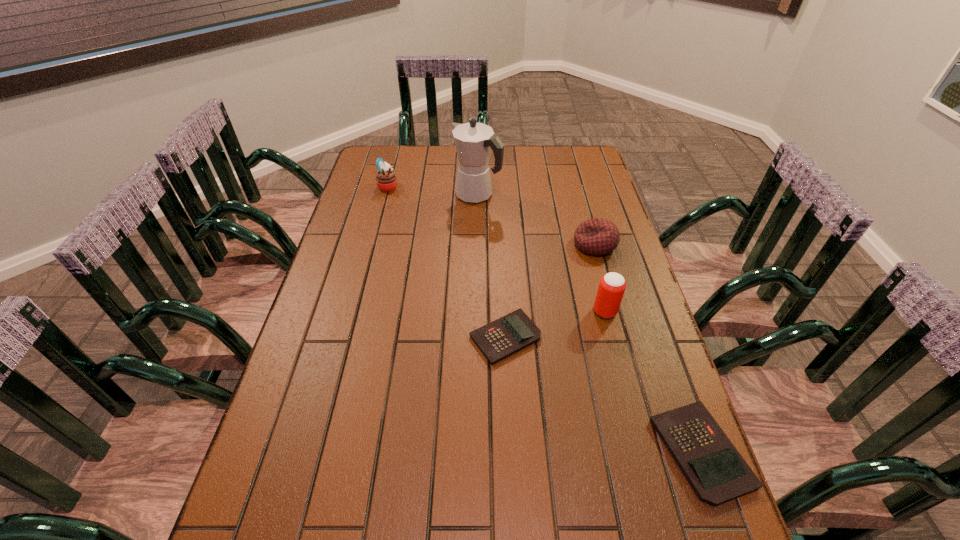
Identify the location of object that is at the near right corner. (716, 471).

Locate an element on the screen. This screenshot has width=960, height=540. vacant area at the far edge is located at coordinates (409, 177).

In the image, there is a desktop. Identify the location of vacant space at the near edge. (346, 485).

Locate an element on the screen. This screenshot has width=960, height=540. vacant space at the left edge of the desktop is located at coordinates (376, 207).

Where is `vacant space at the right edge`? This screenshot has height=540, width=960. vacant space at the right edge is located at coordinates (635, 371).

At what (x,y) coordinates should I click in order to perform the action: click on free space at the far left corner. Please return your answer as a coordinate pair (x, y). Looking at the image, I should click on (405, 163).

Image resolution: width=960 pixels, height=540 pixels. Identify the location of free space at the far right corner of the desktop. [x=558, y=148].

Locate an element on the screen. The width and height of the screenshot is (960, 540). empty space that is in between the shortest object and the beanbag is located at coordinates (550, 291).

Where is `vacant point located between the right calculator and the leftmost object`? The width and height of the screenshot is (960, 540). vacant point located between the right calculator and the leftmost object is located at coordinates (544, 319).

The image size is (960, 540). Find the location of `vacant space that's between the muffin and the beer can`. vacant space that's between the muffin and the beer can is located at coordinates (496, 249).